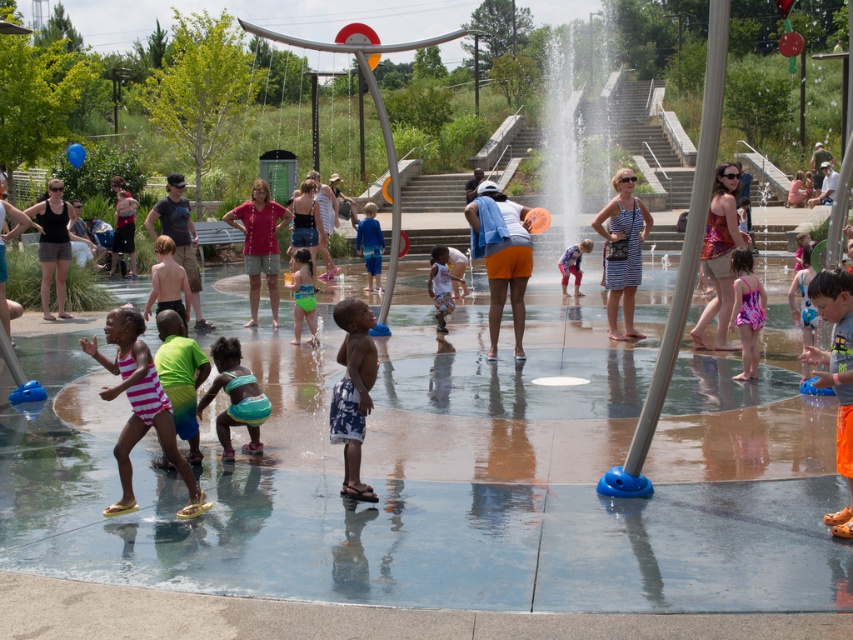
Measure the distance between matte pink shirt at center and camera.

matte pink shirt at center and camera are 12.86 meters apart from each other.

From the picture: Between matte pink shirt at center and matte black tank top at left, which one has less height?

Standing shorter between the two is matte black tank top at left.

Locate an element on the screen. matte pink shirt at center is located at coordinates (260, 244).

Identify the location of matte pink shirt at center. The width and height of the screenshot is (853, 640). (260, 244).

Between point (132, 358) and point (274, 248), which one is positioned in front?

Positioned in front is point (132, 358).

Does striped cotton swimsuit at lower left lie in front of matte pink shirt at center?

Yes, it is in front of matte pink shirt at center.

Find the location of `striped cotton swimsuit at lower left`. striped cotton swimsuit at lower left is located at coordinates (138, 406).

Which is in front, point (709, 316) or point (56, 212)?

Point (709, 316)

Between printed fabric tank top at center and matte black tank top at left, which one has less height?

With less height is matte black tank top at left.

Is point (730, 243) closer to viewer compared to point (42, 305)?

Yes.

The width and height of the screenshot is (853, 640). What are the coordinates of `printed fabric tank top at center` in the screenshot? It's located at (718, 253).